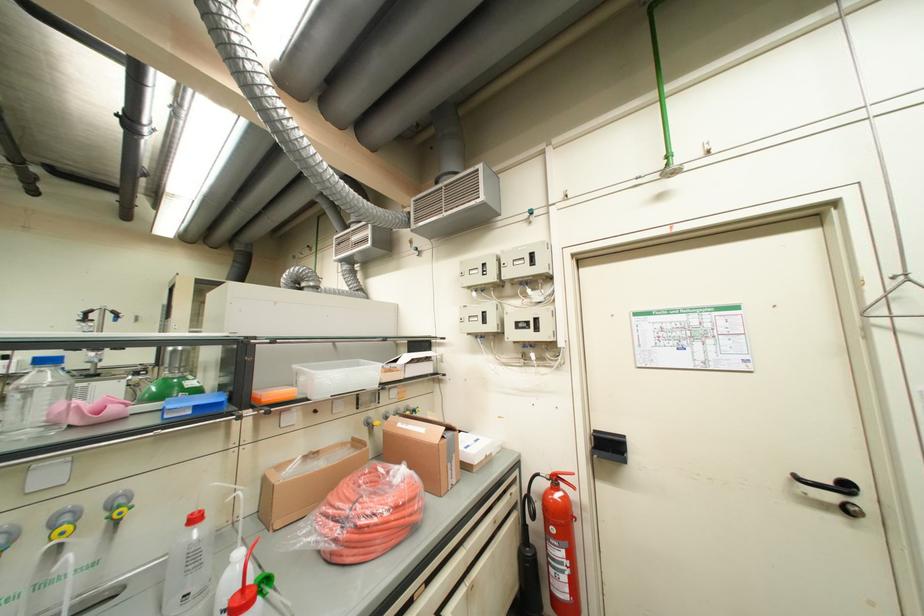
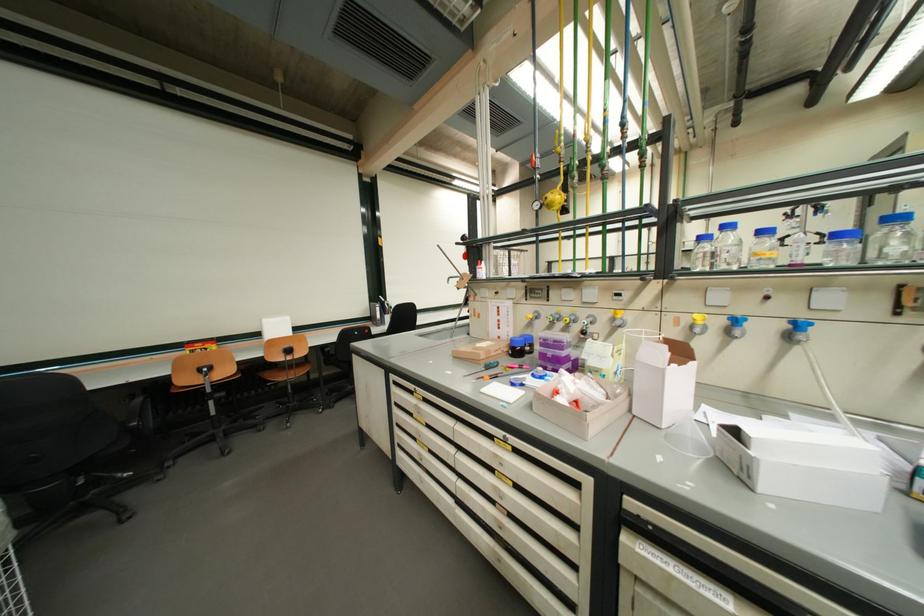
Question: How did the camera likely rotate?

Choices:
 (A) Left
 (B) Right
 (C) Up
 (D) Down

Answer: (A)